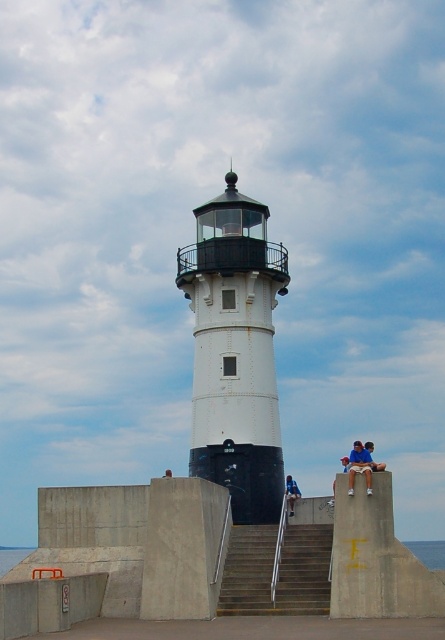
You are standing on the concrete stairs at center and want to reach the blue denim jeans at lower center. Which direction should you move?

The concrete stairs at center is below the blue denim jeans at lower center, so you should move downward to reach the blue denim jeans at lower center.

You are standing at the point marked by the coordinates (235, 352). Looking around, you see the white matte lightweight tower at center. Which direction should you face to see the lighthouse?

The point marked by the coordinates (235, 352) is the location of the white matte lightweight tower at center, so you are already at the tower. Therefore, you don not need to face any direction to see the lighthouse as you are standing at its base.